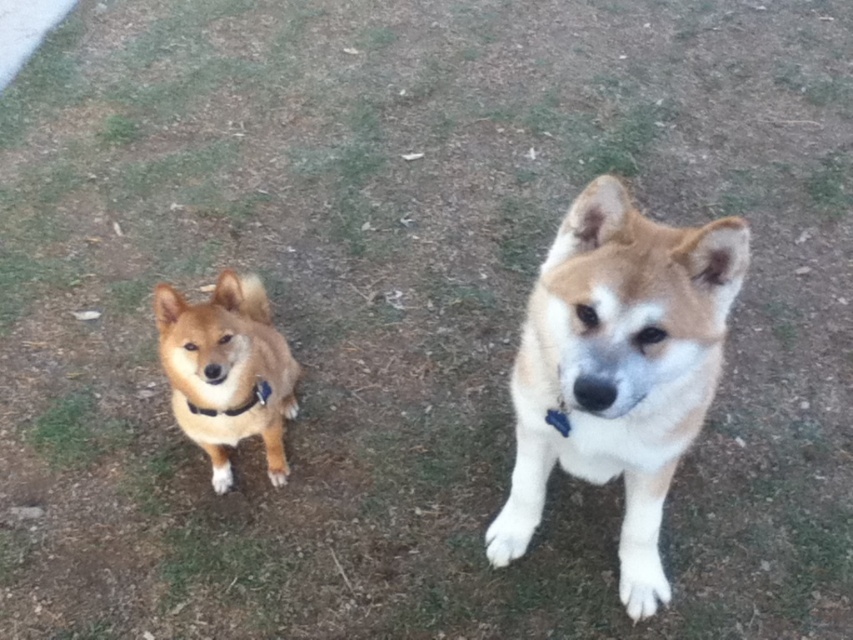
Question: Does light brown fur dog at center appear over golden fur dog at center?

Choices:
 (A) no
 (B) yes

Answer: (B)

Question: Which is nearer to the black fabric neckband at center?

Choices:
 (A) golden fur dog at center
 (B) light brown fur dog at center

Answer: (A)

Question: Which point is closer to the camera?

Choices:
 (A) golden fur dog at center
 (B) light brown fur dog at center
 (C) black fabric neckband at center

Answer: (B)

Question: Does golden fur dog at center have a lesser width compared to black fabric neckband at center?

Choices:
 (A) yes
 (B) no

Answer: (B)

Question: Is golden fur dog at center positioned behind black fabric neckband at center?

Choices:
 (A) no
 (B) yes

Answer: (A)

Question: Which object appears farthest from the camera in this image?

Choices:
 (A) golden fur dog at center
 (B) black fabric neckband at center

Answer: (B)